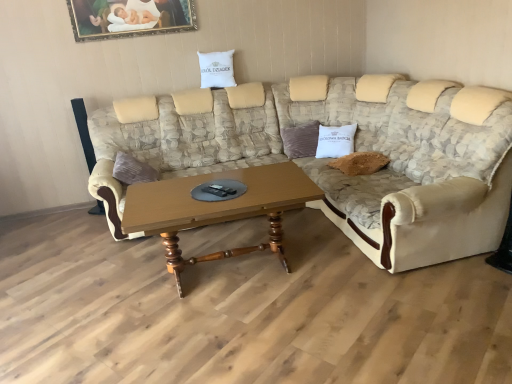
Question: Can you confirm if beige fabric couch at center is positioned to the left of white cotton pillow at center, which is the second pillow from top to bottom?

Choices:
 (A) yes
 (B) no

Answer: (A)

Question: Is beige fabric couch at center in contact with white cotton pillow at center, marked as the first pillow in a bottom-to-top arrangement?

Choices:
 (A) yes
 (B) no

Answer: (B)

Question: Does beige fabric couch at center have a larger size compared to white cotton pillow at center, marked as the first pillow in a bottom-to-top arrangement?

Choices:
 (A) no
 (B) yes

Answer: (B)

Question: Does beige fabric couch at center have a lesser height compared to white cotton pillow at center, which is the second pillow from top to bottom?

Choices:
 (A) no
 (B) yes

Answer: (A)

Question: Does beige fabric couch at center have a greater width compared to white cotton pillow at center, which is the second pillow from top to bottom?

Choices:
 (A) no
 (B) yes

Answer: (B)

Question: Can you confirm if beige fabric couch at center is thinner than white cotton pillow at center, which is the second pillow from top to bottom?

Choices:
 (A) no
 (B) yes

Answer: (A)

Question: Is gold-framed painting at upper center oriented away from wooden polished coffee table at center?

Choices:
 (A) yes
 (B) no

Answer: (B)

Question: From a real-world perspective, is gold-framed painting at upper center physically below wooden polished coffee table at center?

Choices:
 (A) yes
 (B) no

Answer: (B)

Question: Does gold-framed painting at upper center have a greater height compared to wooden polished coffee table at center?

Choices:
 (A) yes
 (B) no

Answer: (B)

Question: Is gold-framed painting at upper center directly adjacent to wooden polished coffee table at center?

Choices:
 (A) no
 (B) yes

Answer: (A)

Question: Would you say gold-framed painting at upper center is outside wooden polished coffee table at center?

Choices:
 (A) yes
 (B) no

Answer: (A)

Question: Is gold-framed painting at upper center to the right of wooden polished coffee table at center from the viewer's perspective?

Choices:
 (A) no
 (B) yes

Answer: (A)

Question: Is gold-framed painting at upper center at the left side of white cotton pillow at upper center, which is the second pillow from right to left?

Choices:
 (A) yes
 (B) no

Answer: (A)